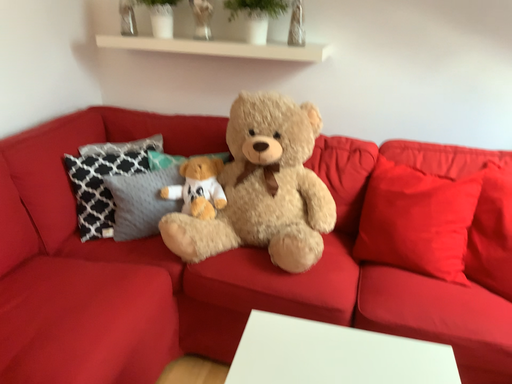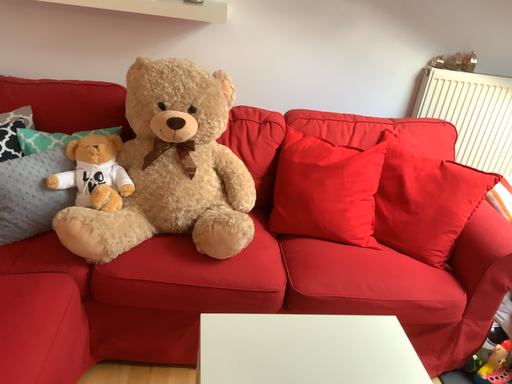
Question: Which way did the camera rotate in the video?

Choices:
 (A) rotated right
 (B) rotated left

Answer: (A)